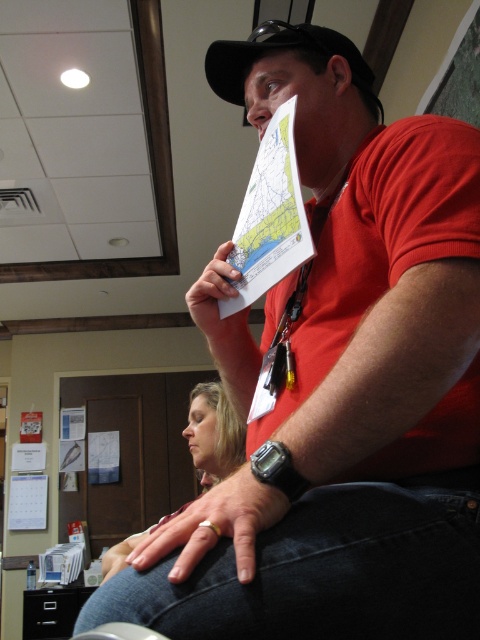
Question: Which point appears closest to the camera in this image?

Choices:
 (A) coord(229,244)
 (B) coord(288,36)
 (C) coord(208,477)

Answer: (A)

Question: Which point is closer to the camera?

Choices:
 (A) (194, 502)
 (B) (204, 428)

Answer: (A)

Question: Which of the following is the farthest from the observer?

Choices:
 (A) (239, 42)
 (B) (227, 248)

Answer: (A)

Question: Is black matte baseball cap at upper center thinner than blonde hair at lower left?

Choices:
 (A) yes
 (B) no

Answer: (A)

Question: From the image, what is the correct spatial relationship of black matte baseball cap at upper center in relation to white paper at center?

Choices:
 (A) right
 (B) left

Answer: (A)

Question: Does black matte baseball cap at upper center come in front of white paper at center?

Choices:
 (A) no
 (B) yes

Answer: (A)